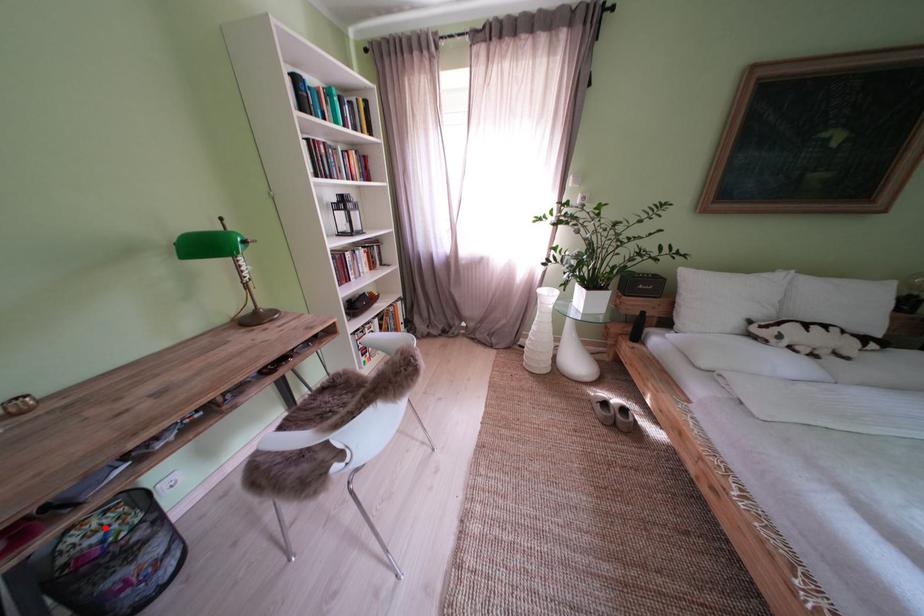
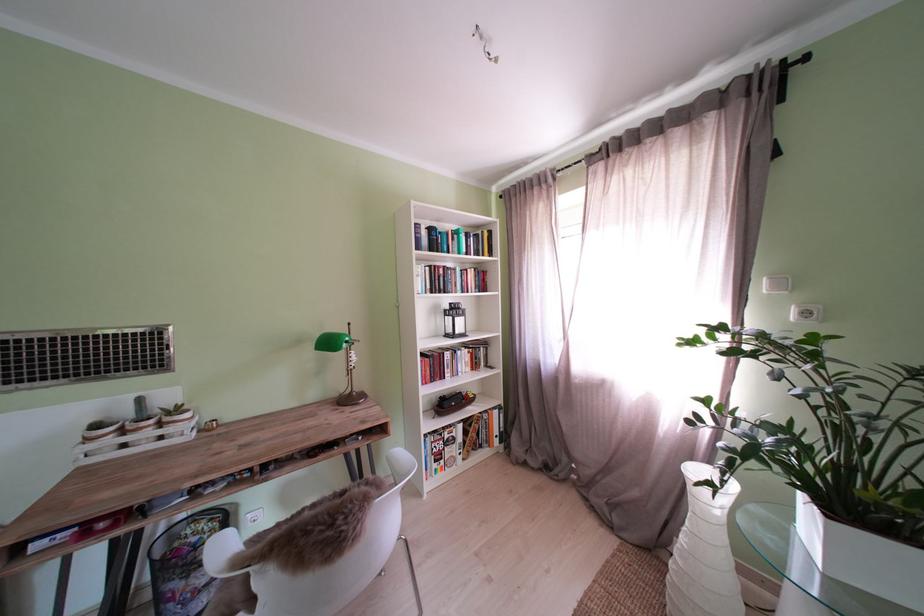
Question: A red point is marked in image1. In image2, is the corresponding 3D point closer to the camera or farther? Reply with the corresponding letter.

Choices:
 (A) The corresponding 3D point is closer.
 (B) The corresponding 3D point is farther.

Answer: (A)